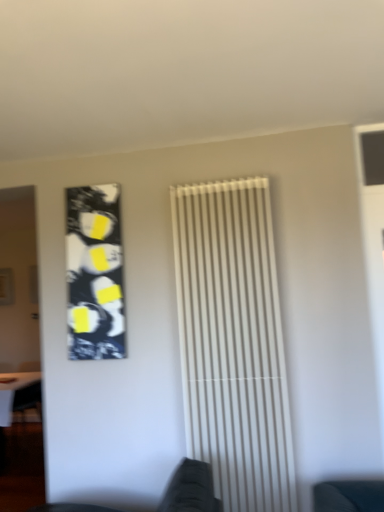
Question: From a real-world perspective, is black and white abstract art at upper left beneath white glossy table at lower left?

Choices:
 (A) no
 (B) yes

Answer: (A)

Question: Is black and white abstract art at upper left shorter than white glossy table at lower left?

Choices:
 (A) no
 (B) yes

Answer: (A)

Question: Is black and white abstract art at upper left closer to the viewer compared to white glossy table at lower left?

Choices:
 (A) no
 (B) yes

Answer: (B)

Question: Is black and white abstract art at upper left looking in the opposite direction of white glossy table at lower left?

Choices:
 (A) yes
 (B) no

Answer: (B)

Question: From the image's perspective, does black and white abstract art at upper left appear lower than white glossy table at lower left?

Choices:
 (A) no
 (B) yes

Answer: (A)

Question: Could white glossy table at lower left be considered to be inside black and white abstract art at upper left?

Choices:
 (A) yes
 (B) no

Answer: (B)

Question: Can you confirm if black and white abstract art at upper left is bigger than white matte radiator at center?

Choices:
 (A) no
 (B) yes

Answer: (A)

Question: Is black and white abstract art at upper left to the left of white matte radiator at center from the viewer's perspective?

Choices:
 (A) no
 (B) yes

Answer: (B)

Question: Is black and white abstract art at upper left positioned behind white matte radiator at center?

Choices:
 (A) yes
 (B) no

Answer: (A)

Question: Does black and white abstract art at upper left lie in front of white matte radiator at center?

Choices:
 (A) yes
 (B) no

Answer: (B)

Question: Is black and white abstract art at upper left facing away from white matte radiator at center?

Choices:
 (A) no
 (B) yes

Answer: (A)

Question: From a real-world perspective, is black and white abstract art at upper left positioned under white matte radiator at center based on gravity?

Choices:
 (A) no
 (B) yes

Answer: (A)

Question: Is white glossy table at lower left next to white matte radiator at center?

Choices:
 (A) yes
 (B) no

Answer: (B)